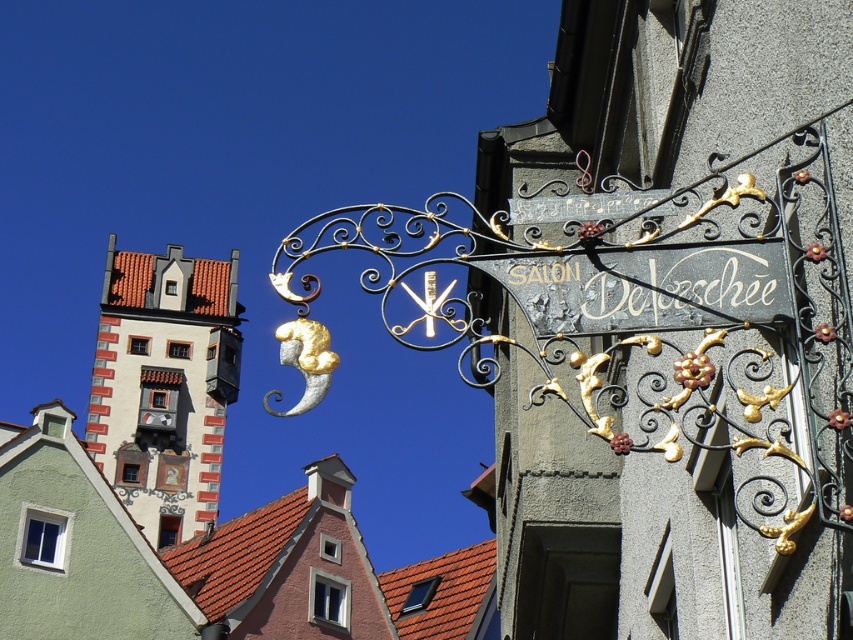
You are an architect analyzing the scene. You need to determine which object occupies more visual space in the image. Based on the information provided, which one is larger in size between the white painted building at upper left and the black wrought iron sign at upper center?

The white painted building at upper left is larger in size than the black wrought iron sign at upper center according to the description.

You are standing on the street looking at the buildings. Which object is closer to you, the white painted building at upper left or the black wrought iron sign at upper center?

The white painted building at upper left is closer to you than the black wrought iron sign at upper center because the sign is positioned behind the building.